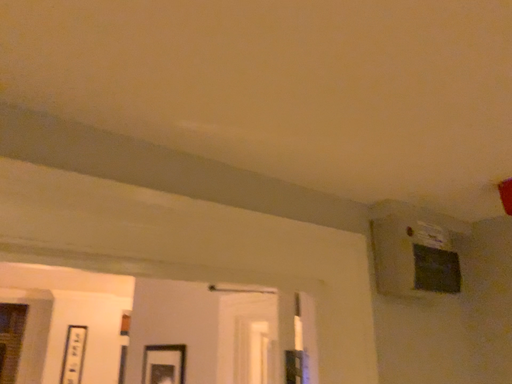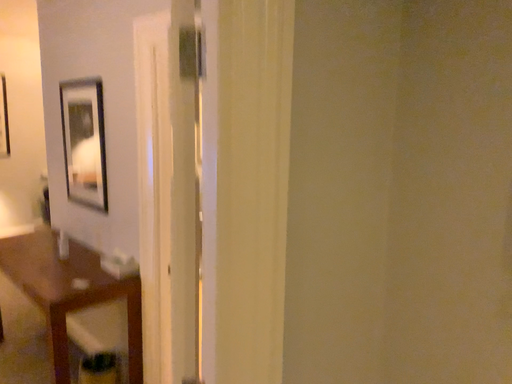
Question: Which way did the camera rotate in the video?

Choices:
 (A) rotated right
 (B) rotated left

Answer: (A)